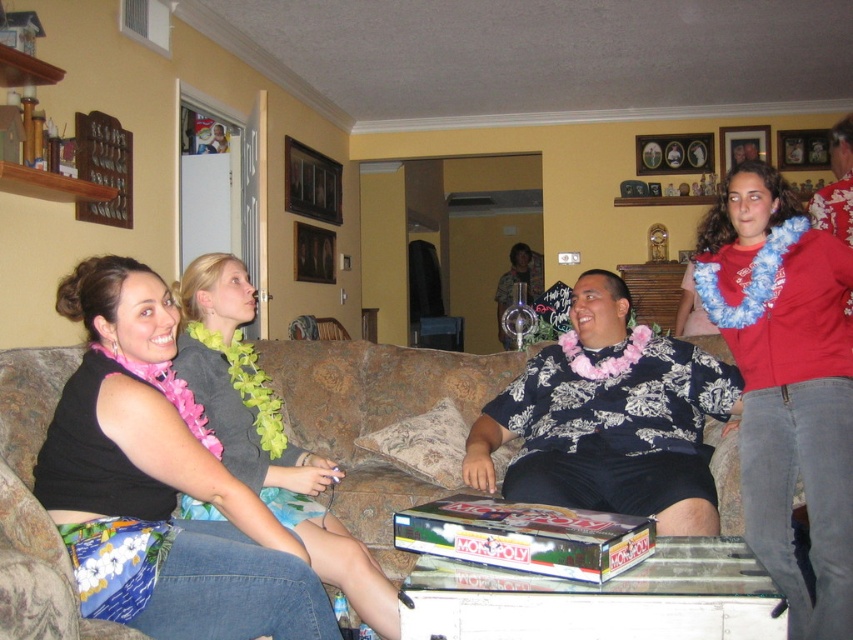
Question: Which point is farther to the camera?

Choices:
 (A) (788, 241)
 (B) (67, 285)
 (C) (13, 492)

Answer: (A)

Question: Is brown fabric couch at center further to the viewer compared to pink floral shirt at center?

Choices:
 (A) yes
 (B) no

Answer: (A)

Question: Can you confirm if red fabric lei at right is thinner than pink floral shirt at center?

Choices:
 (A) no
 (B) yes

Answer: (B)

Question: Does black fabric shirt at left have a smaller size compared to red fabric lei at right?

Choices:
 (A) yes
 (B) no

Answer: (A)

Question: Which point is closer to the camera taking this photo?

Choices:
 (A) (172, 538)
 (B) (813, 244)
 (C) (310, 470)

Answer: (A)

Question: Which object is positioned farthest from the brown fabric couch at center?

Choices:
 (A) red fabric lei at right
 (B) pink fabric lei at center
 (C) pink floral shirt at center

Answer: (A)